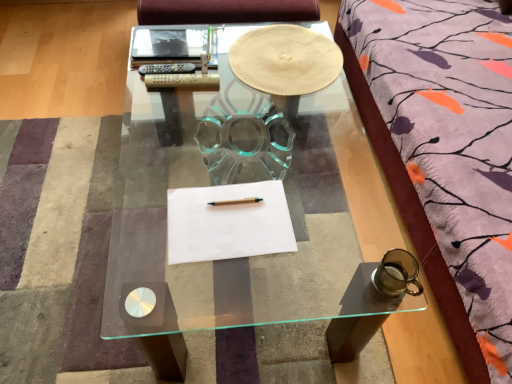
You are a GUI agent. You are given a task and a screenshot of the screen. Output one action in this format:
    pyautogui.click(x=<x>, y=<y>)
    Task: Click on the free area below white paper at upper center, positioned as the first notebook in back-to-front order (from a real-world perspective)
    The width and height of the screenshot is (512, 384).
    Given the screenshot: What is the action you would take?
    pyautogui.click(x=170, y=44)